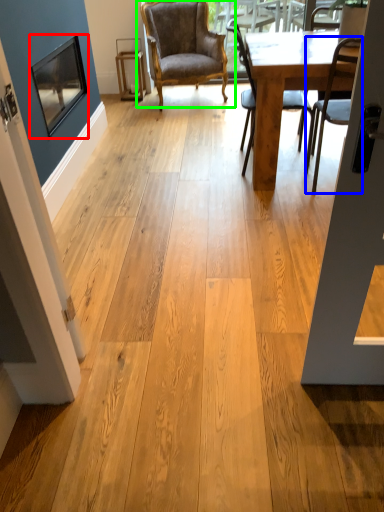
Question: Which object is the farthest from window screen (highlighted by a red box)? Choose among these: chair (highlighted by a blue box) or chair (highlighted by a green box).

Choices:
 (A) chair
 (B) chair

Answer: (A)